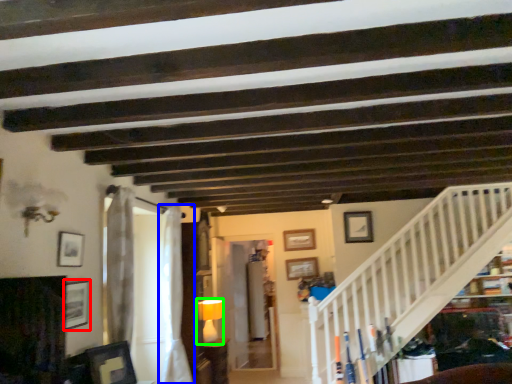
Question: Considering the real-world distances, which object is closest to picture frame (highlighted by a red box)? curtain (highlighted by a blue box) or lamp (highlighted by a green box).

Choices:
 (A) curtain
 (B) lamp

Answer: (A)